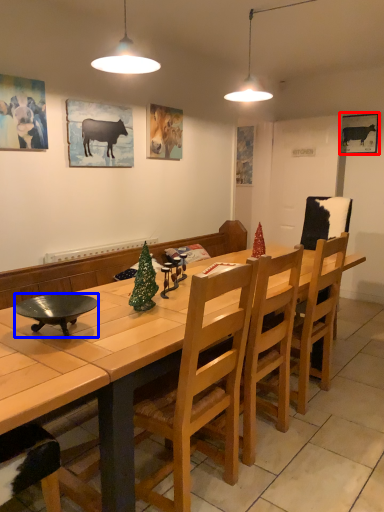
Question: Among these objects, which one is farthest to the camera, picture frame (highlighted by a red box) or bowl (highlighted by a blue box)?

Choices:
 (A) picture frame
 (B) bowl

Answer: (A)